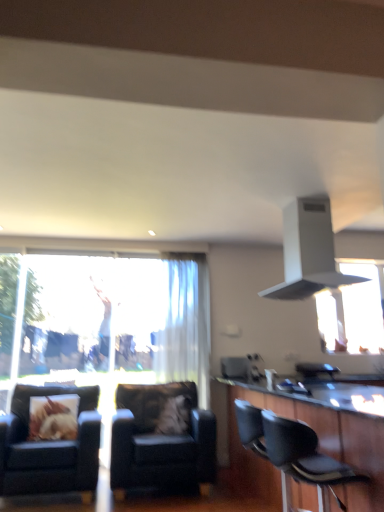
Question: Looking at the image, does black leather barstools at lower right seem bigger or smaller compared to white sheer curtain at center?

Choices:
 (A) big
 (B) small

Answer: (A)

Question: Considering the positions of black leather barstools at lower right and white sheer curtain at center in the image, is black leather barstools at lower right taller or shorter than white sheer curtain at center?

Choices:
 (A) tall
 (B) short

Answer: (B)

Question: Based on their relative distances, which object is farther from the white matte exhaust hood at upper center?

Choices:
 (A) white sheer curtain at center
 (B) black leather chair at lower left, which is the second chair from front to back
 (C) fluffy fabric pillow at center, the 1th pillow positioned from the right
 (D) black leather barstools at lower right
 (E) printed fabric pillow at left, the second pillow positioned from the right

Answer: (E)

Question: Which object is the farthest from the black leather chair at lower right, which is the first chair in right-to-left order?

Choices:
 (A) white sheer curtain at center
 (B) black leather chair at lower left, arranged as the 1th chair when viewed from the left
 (C) black leather barstools at lower right
 (D) printed fabric pillow at left, the second pillow positioned from the right
 (E) white matte exhaust hood at upper center

Answer: (A)